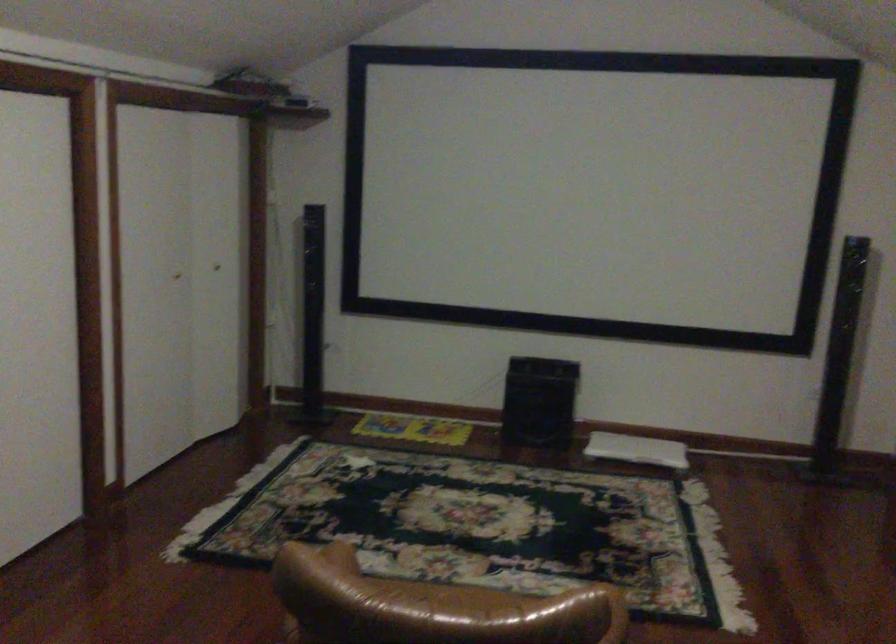
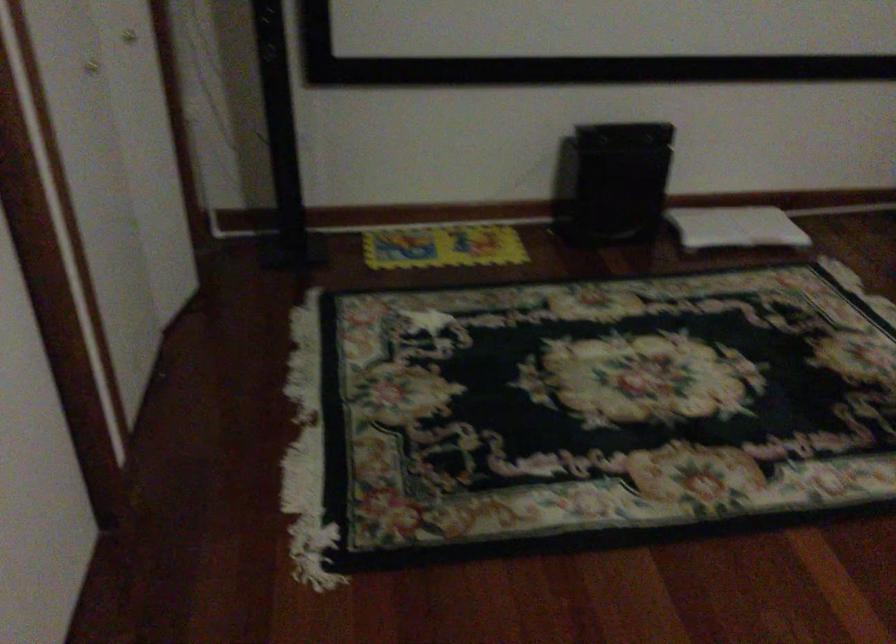
The point at (632, 448) is marked in the first image. Where is the corresponding point in the second image?

(735, 227)